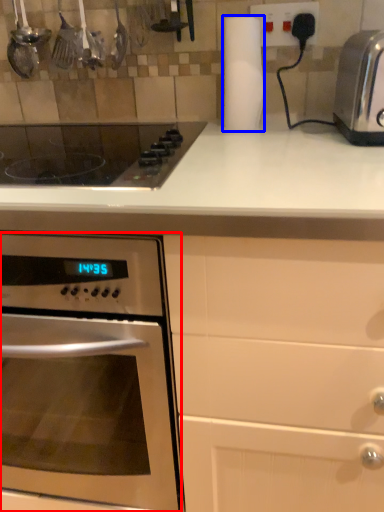
Question: Which of the following is the closest to the observer, oven (highlighted by a red box) or paper towel (highlighted by a blue box)?

Choices:
 (A) oven
 (B) paper towel

Answer: (A)